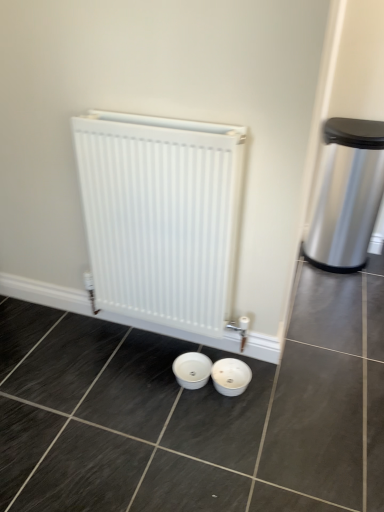
The width and height of the screenshot is (384, 512). Find the location of `vacant area that is in front of white matte radiator at center`. vacant area that is in front of white matte radiator at center is located at coordinates (160, 424).